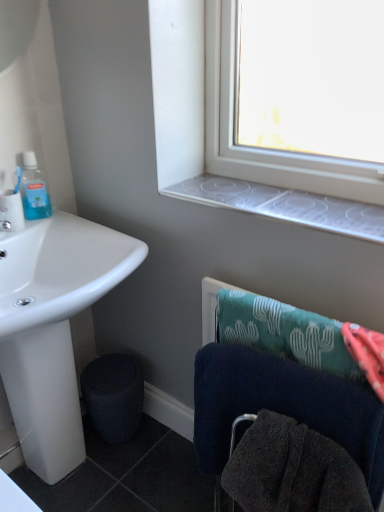
Where is `white glossy sink at lower left`? Image resolution: width=384 pixels, height=512 pixels. white glossy sink at lower left is located at coordinates (53, 328).

Measure the distance between point [48,216] and camera.

Point [48,216] is 1.45 meters from camera.

In order to face clear plastic window sill at upper center, should I rotate leftwards or rightwards?

You should rotate right by 10.711 degrees.

Find the location of a particular element. This screenshot has width=384, height=512. dark blue towel at lower right is located at coordinates click(283, 406).

From the image's perspective, would you say black matte trash bin/can at lower left is positioned over matte white toothbrush at left?

No, from the image's perspective, black matte trash bin/can at lower left is not over matte white toothbrush at left.

Does black matte trash bin/can at lower left contain matte white toothbrush at left?

No, matte white toothbrush at left is not inside black matte trash bin/can at lower left.

From their relative heights in the image, would you say black matte trash bin/can at lower left is taller or shorter than matte white toothbrush at left?

Clearly, black matte trash bin/can at lower left is taller compared to matte white toothbrush at left.

Considering the sizes of objects black matte trash bin/can at lower left and matte white toothbrush at left in the image provided, who is thinner, black matte trash bin/can at lower left or matte white toothbrush at left?

Thinner between the two is matte white toothbrush at left.

Which object is further away from the camera, dark blue towel at lower right or white glossy sink at lower left?

white glossy sink at lower left is further from the camera.

Choose the correct answer: Is dark blue towel at lower right inside white glossy sink at lower left or outside it?

dark blue towel at lower right is located beyond the bounds of white glossy sink at lower left.

In the image, there is a dark blue towel at lower right. At what (x,y) coordinates should I click in order to perform the action: click on sink below it (from a real-world perspective). Please return your answer as a coordinate pair (x, y). The width and height of the screenshot is (384, 512). Looking at the image, I should click on (53, 328).

From the image's perspective, which one is positioned higher, dark blue towel at lower right or black matte trash bin/can at lower left?

dark blue towel at lower right, from the image's perspective.

Is dark blue towel at lower right facing towards black matte trash bin/can at lower left?

No, dark blue towel at lower right is not oriented towards black matte trash bin/can at lower left.

In the scene shown: Is dark blue towel at lower right not near black matte trash bin/can at lower left?

No, dark blue towel at lower right is in close proximity to black matte trash bin/can at lower left.

In the image, is translucent plastic mouthwash at upper left positioned in front of or behind clear plastic window sill at upper center?

In the image, translucent plastic mouthwash at upper left appears behind clear plastic window sill at upper center.

The image size is (384, 512). Identify the location of bottle to the left of clear plastic window sill at upper center. (34, 189).

Which point is more forward, (50, 208) or (249, 211)?

The point (249, 211) is closer to the camera.

Who is taller, translucent plastic mouthwash at upper left or clear plastic window sill at upper center?

translucent plastic mouthwash at upper left is taller.

Between black matte trash bin/can at lower left and translucent plastic mouthwash at upper left, which one has larger width?

black matte trash bin/can at lower left is wider.

From the image's perspective, which one is positioned lower, black matte trash bin/can at lower left or translucent plastic mouthwash at upper left?

black matte trash bin/can at lower left.

Identify the location of bottle that is on the left side of black matte trash bin/can at lower left. (34, 189).

Which of these two, black matte trash bin/can at lower left or translucent plastic mouthwash at upper left, is smaller?

translucent plastic mouthwash at upper left.

Is white glossy sink at lower left not inside matte white toothbrush at left?

That's correct, white glossy sink at lower left is outside of matte white toothbrush at left.

Is white glossy sink at lower left facing towards matte white toothbrush at left?

No, white glossy sink at lower left is not oriented towards matte white toothbrush at left.

Is white glossy sink at lower left bigger or smaller than matte white toothbrush at left?

Considering their sizes, white glossy sink at lower left takes up more space than matte white toothbrush at left.

Which of these two, matte white toothbrush at left or dark blue towel at lower right, is wider?

dark blue towel at lower right.

In terms of height, does matte white toothbrush at left look taller or shorter compared to dark blue towel at lower right?

matte white toothbrush at left is shorter than dark blue towel at lower right.

Is matte white toothbrush at left in front of or behind dark blue towel at lower right in the image?

matte white toothbrush at left is positioned farther from the viewer than dark blue towel at lower right.

Find the location of `trash bin/can on the right of matte white toothbrush at left`. trash bin/can on the right of matte white toothbrush at left is located at coordinates (113, 396).

Where is `towel above the white glossy sink at lower left (from a real-world perspective)`? The image size is (384, 512). towel above the white glossy sink at lower left (from a real-world perspective) is located at coordinates (283, 406).

Based on their spatial positions, is matte white toothbrush at left or black matte trash bin/can at lower left closer to translucent plastic mouthwash at upper left?

Based on the image, matte white toothbrush at left appears to be nearer to translucent plastic mouthwash at upper left.

When comparing their distances from white glossy sink at lower left, does dark blue towel at lower right or black matte trash bin/can at lower left seem closer?

Among the two, black matte trash bin/can at lower left is located nearer to white glossy sink at lower left.

Which object lies further to the anchor point white glossy sink at lower left, dark blue towel at lower right or translucent plastic mouthwash at upper left?

dark blue towel at lower right.

Estimate the real-world distances between objects in this image. Which object is closer to black matte trash bin/can at lower left, white glossy sink at lower left or translucent plastic mouthwash at upper left?

white glossy sink at lower left.

When comparing their distances from white glossy sink at lower left, does translucent plastic mouthwash at upper left or clear plastic window sill at upper center seem further?

clear plastic window sill at upper center is further to white glossy sink at lower left.

Considering their positions, is translucent plastic mouthwash at upper left positioned closer to white glossy sink at lower left than black matte trash bin/can at lower left?

Based on the image, black matte trash bin/can at lower left appears to be nearer to white glossy sink at lower left.

Which object lies further to the anchor point translucent plastic mouthwash at upper left, matte white toothbrush at left or clear plastic window sill at upper center?

Based on the image, clear plastic window sill at upper center appears to be further to translucent plastic mouthwash at upper left.

Looking at the image, which one is located closer to translucent plastic mouthwash at upper left, dark blue towel at lower right or white glossy sink at lower left?

white glossy sink at lower left.

Locate an element on the screen. This screenshot has width=384, height=512. sink between translucent plastic mouthwash at upper left and dark blue towel at lower right is located at coordinates (53, 328).

In order to click on coffee cup between translucent plastic mouthwash at upper left and black matte trash bin/can at lower left in the vertical direction in this screenshot , I will do `click(11, 211)`.

I want to click on sink between clear plastic window sill at upper center and black matte trash bin/can at lower left from top to bottom, so click(53, 328).

Image resolution: width=384 pixels, height=512 pixels. In order to click on sink between translucent plastic mouthwash at upper left and clear plastic window sill at upper center in this screenshot , I will do pyautogui.click(x=53, y=328).